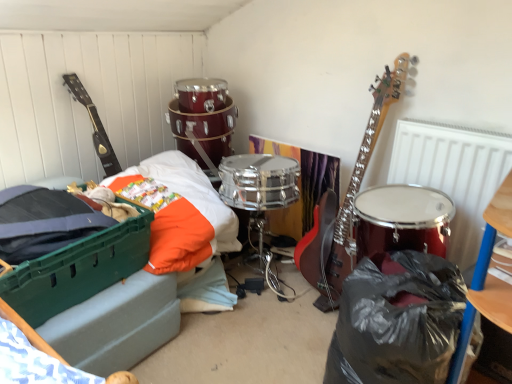
Question: From the image's perspective, relative to matte black guitar at left, is metallic silver radiator at upper right above or below?

Choices:
 (A) below
 (B) above

Answer: (A)

Question: From their relative heights in the image, would you say metallic silver radiator at upper right is taller or shorter than matte black guitar at left?

Choices:
 (A) short
 (B) tall

Answer: (B)

Question: Which is farther from the matte black guitar at left?

Choices:
 (A) metallic silver radiator at upper right
 (B) black plastic bag at lower right
 (C) green plastic storage box at left
 (D) black plastic bag at lower right
 (E) green plastic bed at lower left

Answer: (D)

Question: Which of these objects is positioned farthest from the metallic silver radiator at upper right?

Choices:
 (A) green plastic bed at lower left
 (B) green plastic storage box at left
 (C) matte black guitar at left
 (D) black plastic bag at lower right
 (E) black plastic bag at lower right

Answer: (C)